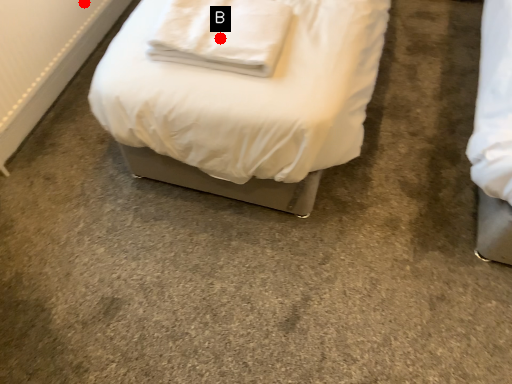
Question: Two points are circled on the image, labeled by A and B beside each circle. Which point appears farthest from the camera in this image?

Choices:
 (A) A is further
 (B) B is further

Answer: (A)